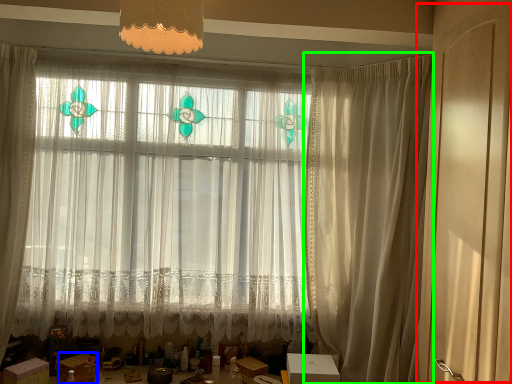
Question: Which object is positioned closest to screen door (highlighted by a red box)? Select from cardboard box (highlighted by a blue box) and curtain (highlighted by a green box).

Choices:
 (A) cardboard box
 (B) curtain

Answer: (B)